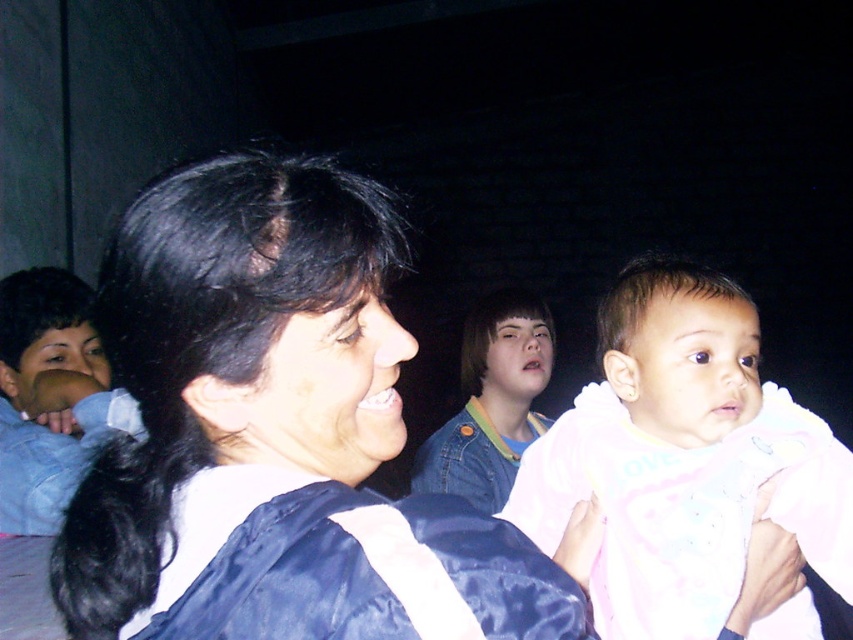
You are organizing a clothing display and need to arrange the blue denim jacket at left and the denim jacket at center according to their positions in the image. Which jacket should be placed to the left in the display?

The blue denim jacket at left should be placed to the left in the display because it is positioned on the left side of the denim jacket at center in the image.